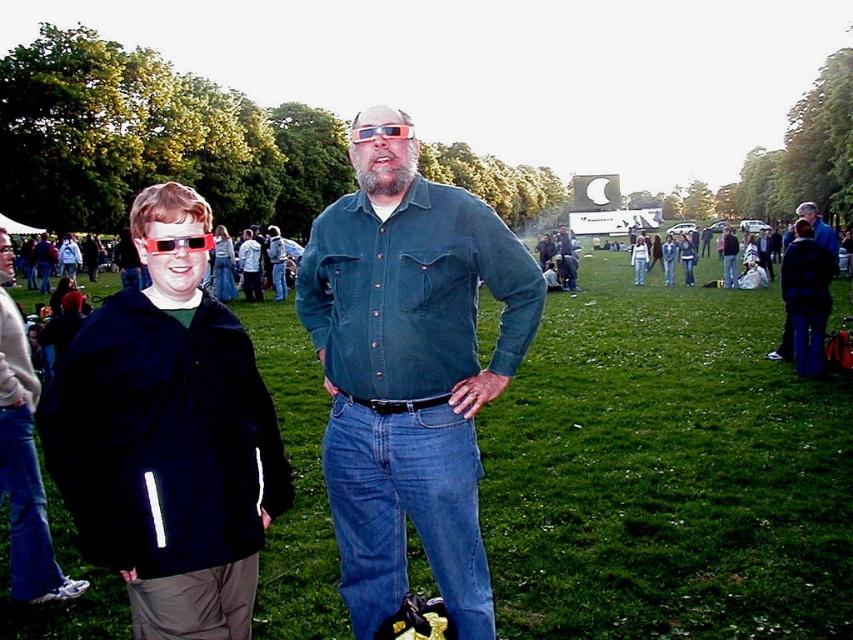
Locate an element on the screen. denim shirt at center is located at coordinates (410, 376).

Which is more to the left, denim shirt at center or black fleece jacket at left?

From the viewer's perspective, black fleece jacket at left appears more on the left side.

Is point (404, 529) closer to viewer compared to point (163, 412)?

No, it is behind (163, 412).

Identify the location of denim shirt at center. The width and height of the screenshot is (853, 640). (410, 376).

Is denim shirt at center thinner than matte plastic sunglasses at center?

Yes.

Can you confirm if denim shirt at center is bigger than matte plastic sunglasses at center?

Indeed, denim shirt at center has a larger size compared to matte plastic sunglasses at center.

Consider the image. Measure the distance between point (473, 481) and camera.

They are 5.71 meters apart.

Locate an element on the screen. Image resolution: width=853 pixels, height=640 pixels. denim shirt at center is located at coordinates (410, 376).

Can you confirm if green grass at center is smaller than black fleece jacket at left?

No.

Between point (270, 593) and point (148, 484), which one is positioned behind?

The point (270, 593) is more distant.

Is point (656, 557) less distant than point (160, 193)?

No, (656, 557) is behind (160, 193).

The image size is (853, 640). What are the coordinates of `green grass at center` in the screenshot? It's located at (666, 472).